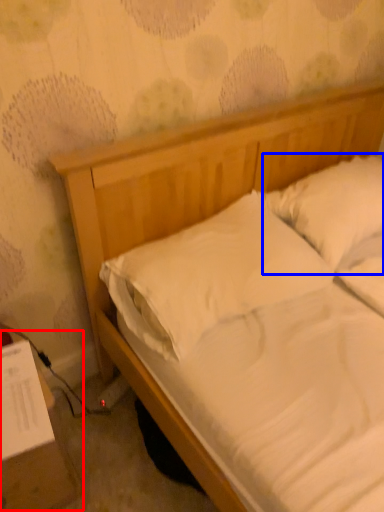
Question: Which object is further to the camera taking this photo, table (highlighted by a red box) or pillow (highlighted by a blue box)?

Choices:
 (A) table
 (B) pillow

Answer: (B)